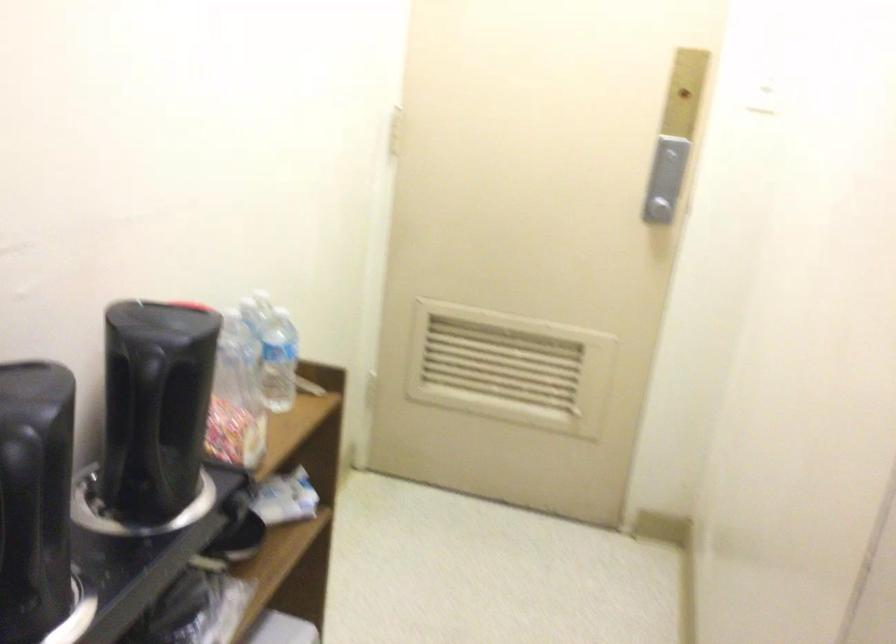
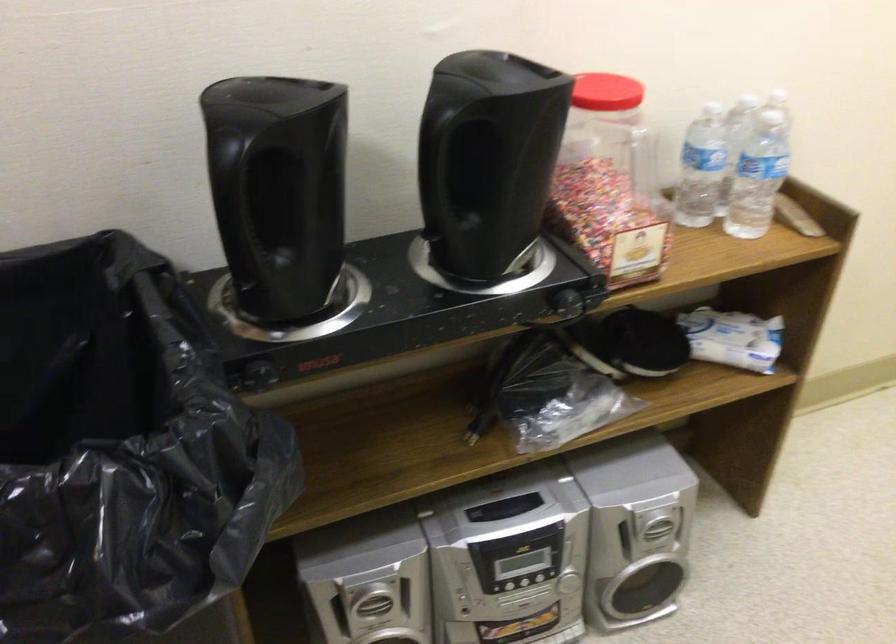
Question: I am providing you with two images of the same scene from different viewpoints. Which of the following objects are not visible in image2?

Choices:
 (A) red jar lid
 (B) black kettle handle
 (C) plastic water bottle
 (D) none of these

Answer: (D)